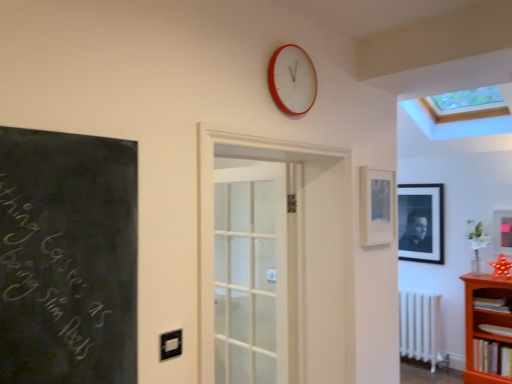
Question: Is black matte picture frame at upper right, which is the second picture frame in right-to-left order, wider or thinner than hardcover book at lower right, positioned as the third book in top-to-bottom order?

Choices:
 (A) thin
 (B) wide

Answer: (A)

Question: In terms of height, does black matte picture frame at upper right, acting as the second picture frame starting from the left, look taller or shorter compared to hardcover book at lower right, positioned as the third book in top-to-bottom order?

Choices:
 (A) tall
 (B) short

Answer: (A)

Question: Based on their relative distances, which object is farther from the white glass door at center?

Choices:
 (A) matte black picture frame at right, the second picture frame positioned from the front
 (B) black matte picture frame at upper right, the 1th picture frame viewed from the back
 (C) white matte radiator at lower right
 (D) matte orange book at lower right, acting as the second book starting from the bottom
 (E) hardcover book at lower right, acting as the first book starting from the top

Answer: (D)

Question: Estimate the real-world distances between objects in this image. Which object is closer to the matte orange book at lower right, the second book when ordered from top to bottom?

Choices:
 (A) black matte picture frame at upper right, the third picture frame from the front
 (B) white matte radiator at lower right
 (C) matte black picture frame at upper right, which appears as the 3th picture frame when viewed from the right
 (D) transparent glass skylight at upper center
 (E) red plastic wall clock at upper center

Answer: (B)